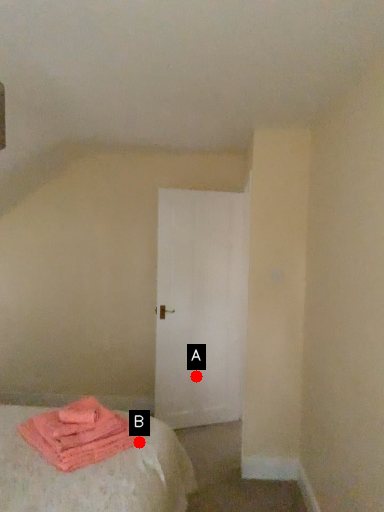
Question: Two points are circled on the image, labeled by A and B beside each circle. Which point appears closest to the camera in this image?

Choices:
 (A) A is closer
 (B) B is closer

Answer: (B)